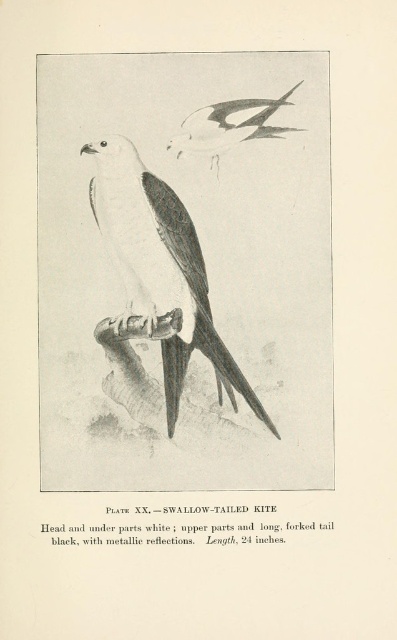
Can you confirm if white matte swallow-tailed kite at center is taller than white paper cutout of bird at upper center?

Yes.

Does white matte swallow-tailed kite at center have a lesser height compared to white paper cutout of bird at upper center?

No, white matte swallow-tailed kite at center is not shorter than white paper cutout of bird at upper center.

Identify the location of white matte swallow-tailed kite at center. (161, 269).